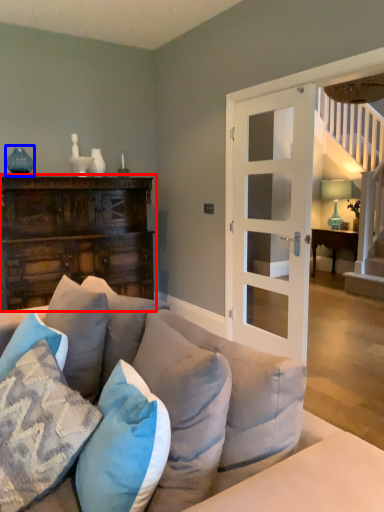
Question: Which object appears farthest to the camera in this image, cabinetry (highlighted by a red box) or teal (highlighted by a blue box)?

Choices:
 (A) cabinetry
 (B) teal

Answer: (B)